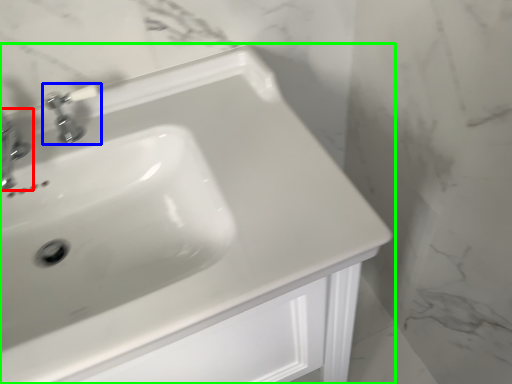
Question: Which object is the closest to the tap (highlighted by a red box)? Choose among these: tap (highlighted by a blue box) or sink (highlighted by a green box).

Choices:
 (A) tap
 (B) sink

Answer: (A)